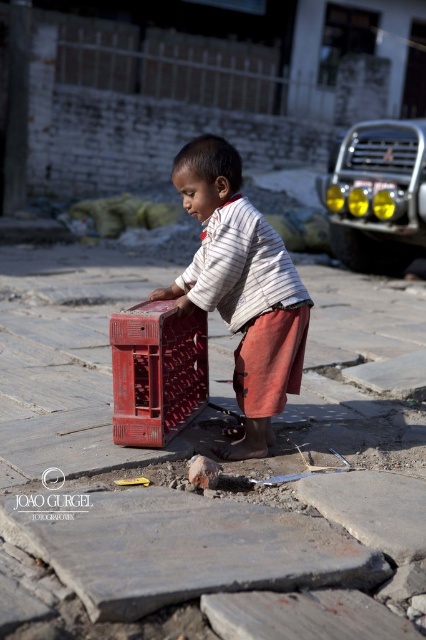
Question: Based on their relative distances, which object is nearer to the matte plastic basket at center?

Choices:
 (A) smooth stone pavement at center
 (B) matte plastic crate at center

Answer: (B)

Question: Among these objects, which one is nearest to the camera?

Choices:
 (A) smooth stone pavement at center
 (B) matte plastic basket at center

Answer: (B)

Question: Is smooth stone pavement at center below matte plastic crate at center?

Choices:
 (A) yes
 (B) no

Answer: (A)

Question: Can you confirm if smooth stone pavement at center is wider than matte plastic crate at center?

Choices:
 (A) yes
 (B) no

Answer: (B)

Question: Which object is closer to the camera taking this photo?

Choices:
 (A) matte plastic basket at center
 (B) smooth stone pavement at center
 (C) matte plastic crate at center

Answer: (A)

Question: Does smooth stone pavement at center appear under matte plastic basket at center?

Choices:
 (A) yes
 (B) no

Answer: (A)